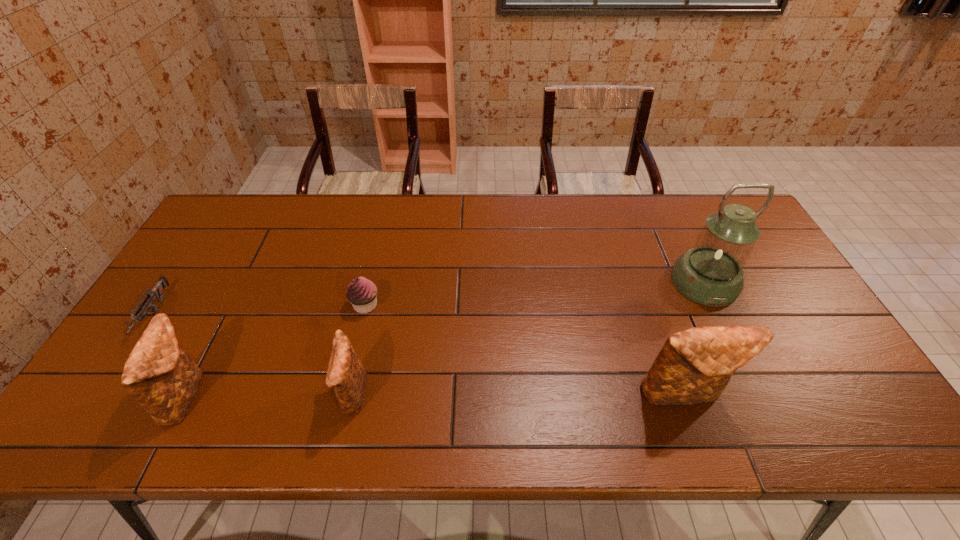
Please determine a free point for an extra clutch_bag to ensure balance. Please provide its 2D coordinates. Your answer should be formatted as a tuple, i.e. [(x, y)], where the tuple contains the x and y coordinates of a point satisfying the conditions above.

[(517, 395)]